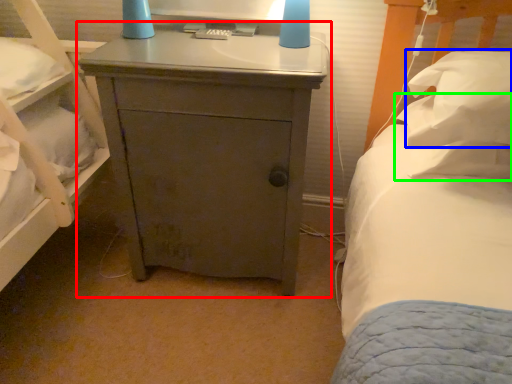
Question: Which is nearer to the nightstand (highlighted by a red box)? pillow (highlighted by a blue box) or pillow (highlighted by a green box).

Choices:
 (A) pillow
 (B) pillow

Answer: (A)